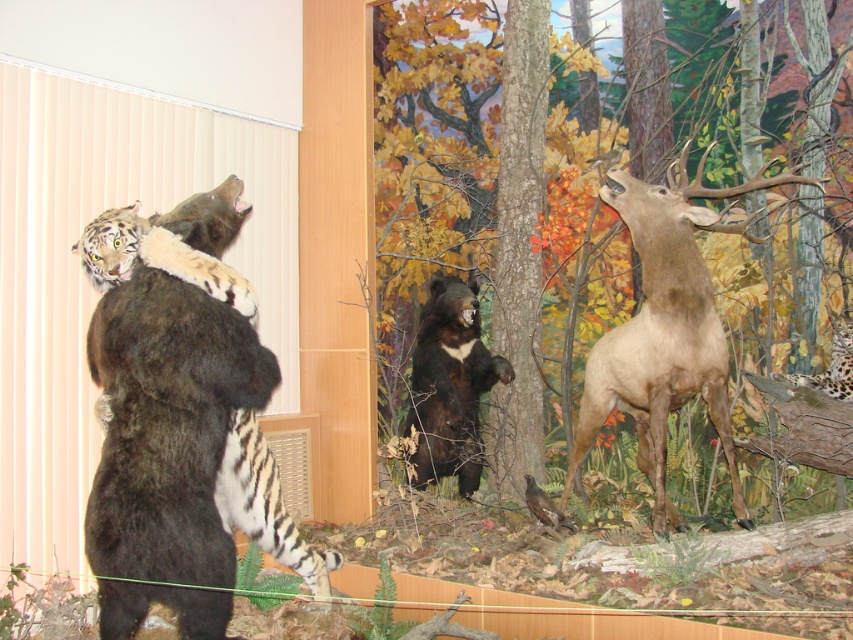
Question: In this image, where is brown wood tree at center located relative to black fur bear at center?

Choices:
 (A) left
 (B) right

Answer: (B)

Question: Which of the following is the farthest from the observer?

Choices:
 (A) (120, 209)
 (B) (602, 385)

Answer: (B)

Question: Where is brown wood tree at center located in relation to black fur bear at center in the image?

Choices:
 (A) right
 (B) left

Answer: (A)

Question: Among these points, which one is nearest to the camera?

Choices:
 (A) (422, 42)
 (B) (724, 440)
 (C) (439, 307)

Answer: (B)

Question: Where is brown fur bear at left located in relation to black fur bear at center in the image?

Choices:
 (A) left
 (B) right

Answer: (A)

Question: Based on their relative distances, which object is farther from the brown matte/deer at right?

Choices:
 (A) brown wood tree at center
 (B) black fur bear at center
 (C) brown fur bear at left

Answer: (C)